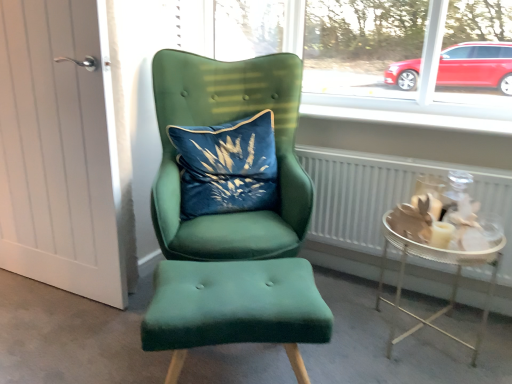
Question: Can you confirm if white smooth window sill at upper center is bigger than velvet green stool at center?

Choices:
 (A) no
 (B) yes

Answer: (A)

Question: Can you confirm if white smooth window sill at upper center is thinner than velvet green stool at center?

Choices:
 (A) yes
 (B) no

Answer: (A)

Question: From the image's perspective, is white smooth window sill at upper center beneath velvet green stool at center?

Choices:
 (A) yes
 (B) no

Answer: (B)

Question: From a real-world perspective, is white smooth window sill at upper center on velvet green stool at center?

Choices:
 (A) no
 (B) yes

Answer: (B)

Question: Is white smooth window sill at upper center outside velvet green stool at center?

Choices:
 (A) yes
 (B) no

Answer: (A)

Question: Does white smooth window sill at upper center have a lesser height compared to velvet green stool at center?

Choices:
 (A) no
 (B) yes

Answer: (B)

Question: Can we say velvet green armchair at center lies outside velvet blue pillow at center?

Choices:
 (A) no
 (B) yes

Answer: (B)

Question: Can you see velvet green armchair at center touching velvet blue pillow at center?

Choices:
 (A) yes
 (B) no

Answer: (B)

Question: Is velvet green armchair at center further to camera compared to velvet blue pillow at center?

Choices:
 (A) yes
 (B) no

Answer: (B)

Question: Can you confirm if velvet green armchair at center is bigger than velvet blue pillow at center?

Choices:
 (A) yes
 (B) no

Answer: (A)

Question: Does velvet green armchair at center appear on the left side of velvet blue pillow at center?

Choices:
 (A) no
 (B) yes

Answer: (A)

Question: Considering the relative sizes of velvet green armchair at center and velvet blue pillow at center in the image provided, is velvet green armchair at center taller than velvet blue pillow at center?

Choices:
 (A) no
 (B) yes

Answer: (B)

Question: From a real-world perspective, does white smooth window sill at upper center stand above velvet blue pillow at center?

Choices:
 (A) yes
 (B) no

Answer: (A)